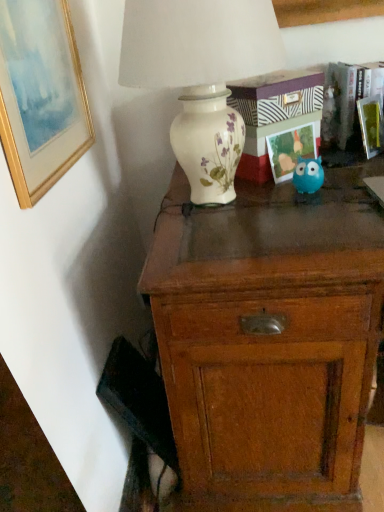
Question: Considering the positions of wooden chest of drawers at center and white ceramic vase at upper center in the image, is wooden chest of drawers at center taller or shorter than white ceramic vase at upper center?

Choices:
 (A) tall
 (B) short

Answer: (A)

Question: In terms of width, does wooden chest of drawers at center look wider or thinner when compared to white ceramic vase at upper center?

Choices:
 (A) wide
 (B) thin

Answer: (A)

Question: Estimate the real-world distances between objects in this image. Which object is closer to the green matte picture frame at upper right, the third picture frame when ordered from left to right?

Choices:
 (A) gold-framed painting at upper left, marked as the third picture frame in a right-to-left arrangement
 (B) matte plastic picture frame at upper right, acting as the second picture frame starting from the left
 (C) blue rubber toy at center
 (D) wooden chest of drawers at center
 (E) white ceramic vase at upper center

Answer: (B)

Question: Estimate the real-world distances between objects in this image. Which object is closer to the gold-framed painting at upper left, marked as the third picture frame in a right-to-left arrangement?

Choices:
 (A) green matte picture frame at upper right, the 1th picture frame viewed from the right
 (B) white ceramic vase at upper center
 (C) matte plastic picture frame at upper right, acting as the second picture frame starting from the left
 (D) wooden chest of drawers at center
 (E) blue rubber toy at center

Answer: (B)